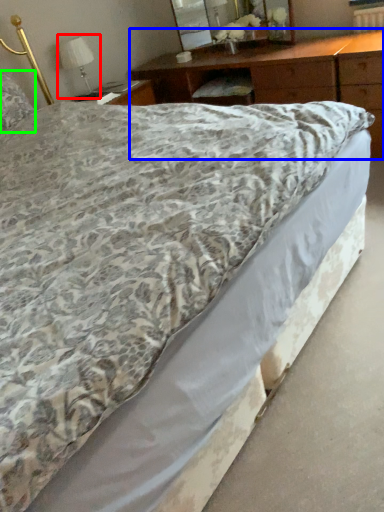
Question: Estimate the real-world distances between objects in this image. Which object is closer to table lamp (highlighted by a red box), nightstand (highlighted by a blue box) or pillow (highlighted by a green box)?

Choices:
 (A) nightstand
 (B) pillow

Answer: (B)